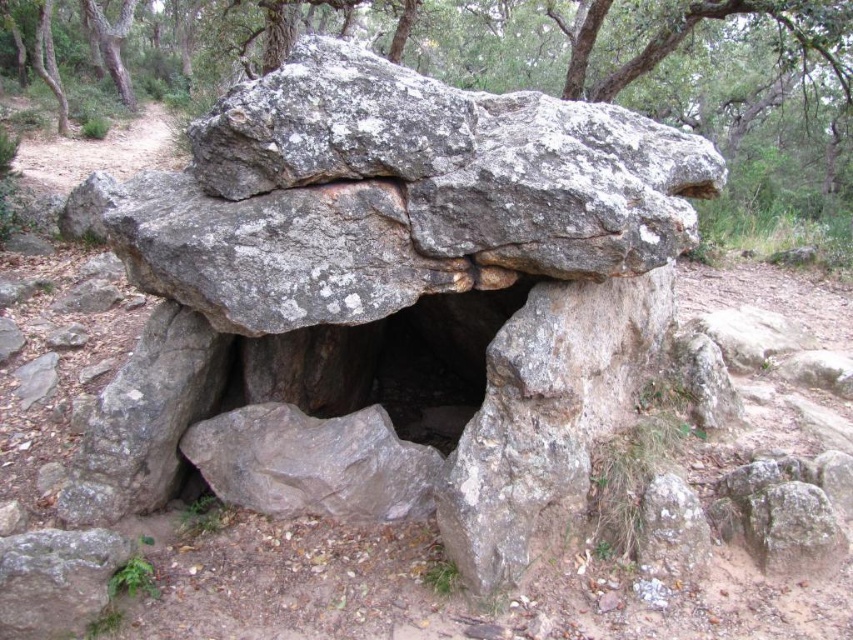
Does point (300, 461) come behind point (532, 56)?

No, (300, 461) is in front of (532, 56).

The height and width of the screenshot is (640, 853). I want to click on gray rough stone at center, so click(x=393, y=300).

Which is in front, point (310, 120) or point (170, 38)?

Point (310, 120)

Find the location of a particular element. Image resolution: width=853 pixels, height=640 pixels. gray rough stone at center is located at coordinates (393, 300).